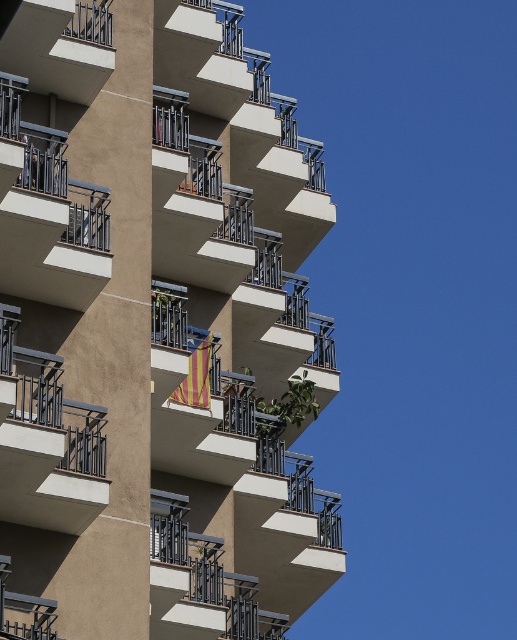
Which is behind, point (65, 307) or point (189, 346)?

Point (189, 346)

Where is `smooth concrete balcony at center`? smooth concrete balcony at center is located at coordinates (155, 328).

Where is `smooth concrete balcony at center`? smooth concrete balcony at center is located at coordinates (155, 328).

You are a GUI agent. You are given a task and a screenshot of the screen. Output one action in this format:
    pyautogui.click(x=<x>, y=<y>)
    Task: Click on the smooth concrete balcony at center
    
    Given the screenshot: What is the action you would take?
    pyautogui.click(x=155, y=328)